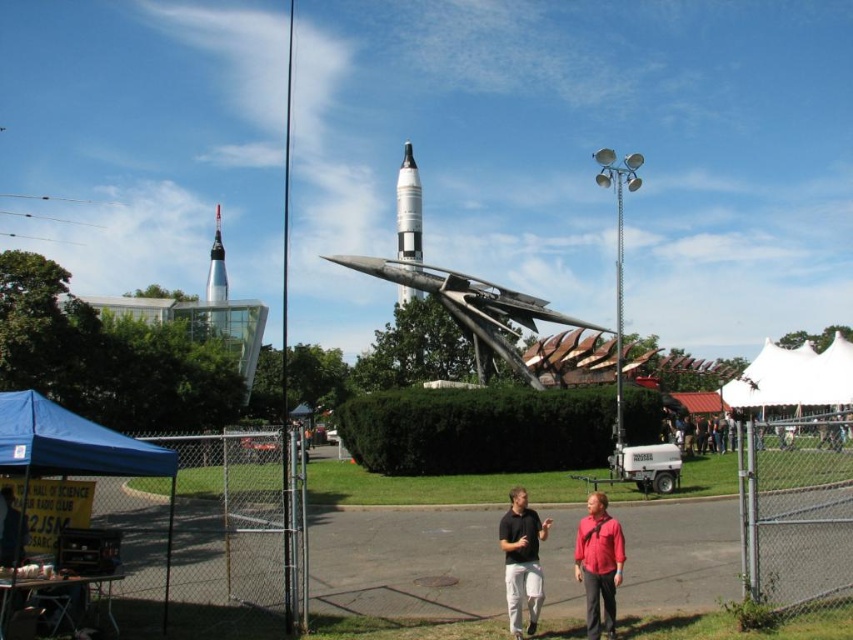
Based on the photo, you are standing at the entrance of the science museum and want to take a photo of the shiny silver rocket at center without any obstructions. The blue fabric canopy at lower left is in your way. Can you move to the right to get a clear shot?

Yes, since the blue fabric canopy at lower left is to the left of the shiny silver rocket at center, moving to the right would position you away from the canopy, allowing an unobstructed view of the rocket.